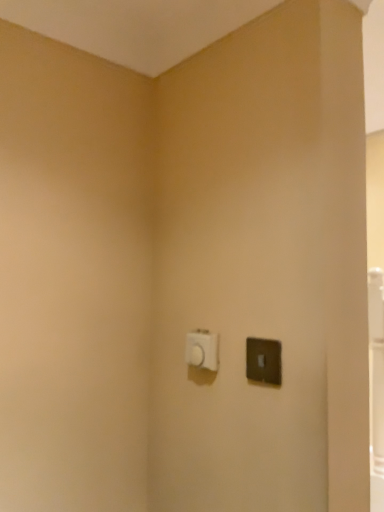
Describe the element at coordinates (202, 349) in the screenshot. The image size is (384, 512). I see `white plastic light switch at center, marked as the second light switch in a right-to-left arrangement` at that location.

In order to click on white plastic light switch at center, placed as the second light switch when sorted from front to back in this screenshot , I will do `click(202, 349)`.

The height and width of the screenshot is (512, 384). What do you see at coordinates (263, 360) in the screenshot?
I see `satin black light switch at right, which is the second light switch from back to front` at bounding box center [263, 360].

Measure the distance between satin black light switch at right, which is counted as the 2th light switch, starting from the left, and camera.

satin black light switch at right, which is counted as the 2th light switch, starting from the left, is 33.98 inches from camera.

Where is `satin black light switch at right, which is the second light switch from back to front`? satin black light switch at right, which is the second light switch from back to front is located at coordinates tap(263, 360).

This screenshot has height=512, width=384. What are the coordinates of `white plastic light switch at center, the 1th light switch viewed from the back` in the screenshot? It's located at (202, 349).

Is satin black light switch at right, which is the second light switch from back to front, at the right side of white plastic light switch at center, placed as the 1th light switch when sorted from left to right?

Indeed, satin black light switch at right, which is the second light switch from back to front, is positioned on the right side of white plastic light switch at center, placed as the 1th light switch when sorted from left to right.

Which object is further away from the camera taking this photo, satin black light switch at right, which is the second light switch from back to front, or white plastic light switch at center, marked as the second light switch in a right-to-left arrangement?

white plastic light switch at center, marked as the second light switch in a right-to-left arrangement, is further from the camera.

Considering the points (269, 345) and (195, 362), which point is in front, point (269, 345) or point (195, 362)?

The point (269, 345) is closer.

Based on the photo, from the image's perspective, does satin black light switch at right, which is the second light switch from back to front, appear lower than white plastic light switch at center, the 1th light switch viewed from the back?

Incorrect, from the image's perspective, satin black light switch at right, which is the second light switch from back to front, is higher than white plastic light switch at center, the 1th light switch viewed from the back.

Consider the image. From a real-world perspective, is satin black light switch at right, which is counted as the 2th light switch, starting from the left, on top of white plastic light switch at center, placed as the 1th light switch when sorted from left to right?

Actually, satin black light switch at right, which is counted as the 2th light switch, starting from the left, is physically below white plastic light switch at center, placed as the 1th light switch when sorted from left to right, in the real world.

Is satin black light switch at right, positioned as the first light switch in front-to-back order, wider than white plastic light switch at center, placed as the 1th light switch when sorted from left to right?

No, satin black light switch at right, positioned as the first light switch in front-to-back order, is not wider than white plastic light switch at center, placed as the 1th light switch when sorted from left to right.

Consider the image. Considering the sizes of satin black light switch at right, positioned as the first light switch in front-to-back order, and white plastic light switch at center, marked as the second light switch in a right-to-left arrangement, in the image, is satin black light switch at right, positioned as the first light switch in front-to-back order, taller or shorter than white plastic light switch at center, marked as the second light switch in a right-to-left arrangement,?

Considering their sizes, satin black light switch at right, positioned as the first light switch in front-to-back order, has more height than white plastic light switch at center, marked as the second light switch in a right-to-left arrangement.

Is satin black light switch at right, which is counted as the 2th light switch, starting from the left, bigger or smaller than white plastic light switch at center, the 1th light switch viewed from the back?

satin black light switch at right, which is counted as the 2th light switch, starting from the left, is smaller than white plastic light switch at center, the 1th light switch viewed from the back.

Is white plastic light switch at center, placed as the 1th light switch when sorted from left to right, completely or partially inside satin black light switch at right, which is the second light switch from back to front?

No, white plastic light switch at center, placed as the 1th light switch when sorted from left to right, is not surrounded by satin black light switch at right, which is the second light switch from back to front.

Are satin black light switch at right, which is counted as the 2th light switch, starting from the left, and white plastic light switch at center, marked as the second light switch in a right-to-left arrangement, making contact?

satin black light switch at right, which is counted as the 2th light switch, starting from the left, and white plastic light switch at center, marked as the second light switch in a right-to-left arrangement, are not in contact.

Is satin black light switch at right, positioned as the first light switch in front-to-back order, oriented towards white plastic light switch at center, marked as the second light switch in a right-to-left arrangement?

No, satin black light switch at right, positioned as the first light switch in front-to-back order, is not turned towards white plastic light switch at center, marked as the second light switch in a right-to-left arrangement.

Can you tell me how much satin black light switch at right, which is counted as the 2th light switch, starting from the left, and white plastic light switch at center, the 1th light switch viewed from the back, differ in facing direction?

0.015 degrees.

The image size is (384, 512). I want to click on light switch below the white plastic light switch at center, placed as the 1th light switch when sorted from left to right (from a real-world perspective), so click(x=263, y=360).

In the scene shown: Does white plastic light switch at center, marked as the second light switch in a right-to-left arrangement, appear on the right side of satin black light switch at right, positioned as the 1th light switch in right-to-left order?

No, white plastic light switch at center, marked as the second light switch in a right-to-left arrangement, is not to the right of satin black light switch at right, positioned as the 1th light switch in right-to-left order.

Relative to satin black light switch at right, which is the second light switch from back to front, is white plastic light switch at center, marked as the second light switch in a right-to-left arrangement, in front or behind?

white plastic light switch at center, marked as the second light switch in a right-to-left arrangement, is behind satin black light switch at right, which is the second light switch from back to front.

Which is less distant, (210, 345) or (250, 337)?

The point (250, 337) is closer.

From the image's perspective, which object appears higher, white plastic light switch at center, the 1th light switch viewed from the back, or satin black light switch at right, positioned as the 1th light switch in right-to-left order?

satin black light switch at right, positioned as the 1th light switch in right-to-left order, appears higher in the image.

From a real-world perspective, is white plastic light switch at center, placed as the 1th light switch when sorted from left to right, on satin black light switch at right, positioned as the first light switch in front-to-back order?

Indeed, from a real-world perspective, white plastic light switch at center, placed as the 1th light switch when sorted from left to right, stands above satin black light switch at right, positioned as the first light switch in front-to-back order.

Which object is wider, white plastic light switch at center, marked as the second light switch in a right-to-left arrangement, or satin black light switch at right, positioned as the 1th light switch in right-to-left order?

Wider between the two is white plastic light switch at center, marked as the second light switch in a right-to-left arrangement.

From their relative heights in the image, would you say white plastic light switch at center, placed as the 1th light switch when sorted from left to right, is taller or shorter than satin black light switch at right, positioned as the first light switch in front-to-back order?

Clearly, white plastic light switch at center, placed as the 1th light switch when sorted from left to right, is shorter compared to satin black light switch at right, positioned as the first light switch in front-to-back order.

Can you confirm if white plastic light switch at center, placed as the second light switch when sorted from front to back, is smaller than satin black light switch at right, which is counted as the 2th light switch, starting from the left?

Incorrect, white plastic light switch at center, placed as the second light switch when sorted from front to back, is not smaller in size than satin black light switch at right, which is counted as the 2th light switch, starting from the left.

Is satin black light switch at right, positioned as the 1th light switch in right-to-left order, located within white plastic light switch at center, marked as the second light switch in a right-to-left arrangement?

Actually, satin black light switch at right, positioned as the 1th light switch in right-to-left order, is outside white plastic light switch at center, marked as the second light switch in a right-to-left arrangement.

Are white plastic light switch at center, placed as the second light switch when sorted from front to back, and satin black light switch at right, which is counted as the 2th light switch, starting from the left, beside each other?

No, white plastic light switch at center, placed as the second light switch when sorted from front to back, is not with satin black light switch at right, which is counted as the 2th light switch, starting from the left.

Is white plastic light switch at center, placed as the second light switch when sorted from front to back, facing towards satin black light switch at right, positioned as the 1th light switch in right-to-left order?

No, white plastic light switch at center, placed as the second light switch when sorted from front to back, is not facing towards satin black light switch at right, positioned as the 1th light switch in right-to-left order.

How many degrees apart are the facing directions of white plastic light switch at center, placed as the second light switch when sorted from front to back, and satin black light switch at right, positioned as the first light switch in front-to-back order?

The facing directions of white plastic light switch at center, placed as the second light switch when sorted from front to back, and satin black light switch at right, positioned as the first light switch in front-to-back order, are 0.015 degrees apart.

How far apart are white plastic light switch at center, placed as the 1th light switch when sorted from left to right, and satin black light switch at right, positioned as the first light switch in front-to-back order?

white plastic light switch at center, placed as the 1th light switch when sorted from left to right, and satin black light switch at right, positioned as the first light switch in front-to-back order, are 13.07 centimeters apart from each other.

This screenshot has height=512, width=384. Find the location of `light switch above the satin black light switch at right, positioned as the first light switch in front-to-back order (from a real-world perspective)`. light switch above the satin black light switch at right, positioned as the first light switch in front-to-back order (from a real-world perspective) is located at coordinates (202, 349).

Image resolution: width=384 pixels, height=512 pixels. In the image, there is a white plastic light switch at center, the 1th light switch viewed from the back. Identify the location of light switch above it (from the image's perspective). (263, 360).

This screenshot has height=512, width=384. What are the coordinates of `light switch located in front of the white plastic light switch at center, placed as the second light switch when sorted from front to back` in the screenshot? It's located at (263, 360).